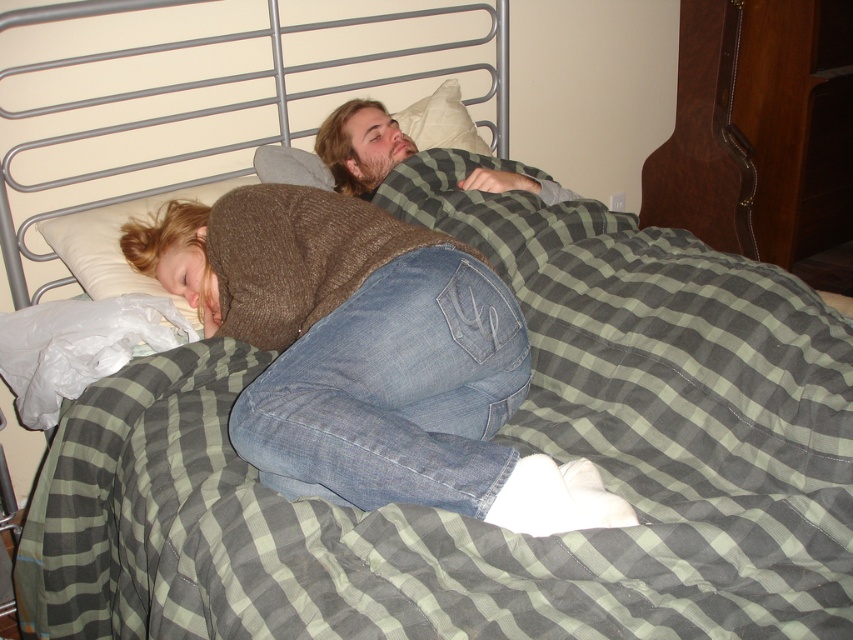
Does brown knitted sweater at center have a smaller size compared to bearded man at center?

Actually, brown knitted sweater at center might be larger than bearded man at center.

Locate an element on the screen. This screenshot has height=640, width=853. brown knitted sweater at center is located at coordinates [368, 356].

Does point (352, 241) come closer to viewer compared to point (381, 118)?

Yes.

In order to click on brown knitted sweater at center in this screenshot , I will do pyautogui.click(x=368, y=356).

Does brown knitted sweater at center appear over white soft pillow at upper center?

Actually, brown knitted sweater at center is below white soft pillow at upper center.

Is brown knitted sweater at center taller than white soft pillow at upper center?

Indeed, brown knitted sweater at center has a greater height compared to white soft pillow at upper center.

Between point (421, 264) and point (440, 140), which one is positioned behind?

Positioned behind is point (440, 140).

Locate an element on the screen. brown knitted sweater at center is located at coordinates (368, 356).

Which is more to the left, metallic silver headboard at upper center or white soft pillow at upper center?

metallic silver headboard at upper center

Can you confirm if metallic silver headboard at upper center is shorter than white soft pillow at upper center?

No, metallic silver headboard at upper center is not shorter than white soft pillow at upper center.

Which is in front, point (496, 42) or point (440, 108)?

Point (440, 108) is in front.

Image resolution: width=853 pixels, height=640 pixels. I want to click on metallic silver headboard at upper center, so click(x=225, y=113).